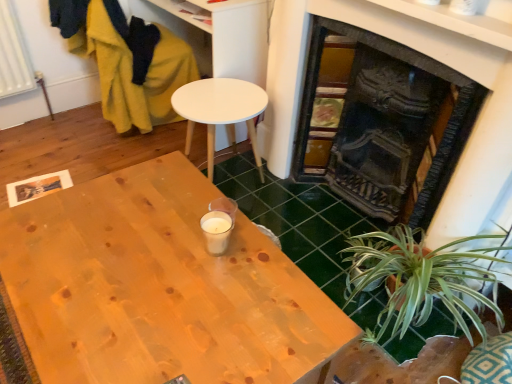
Question: Is green leafy plant at lower right to the left or to the right of white matte table at center in the image?

Choices:
 (A) left
 (B) right

Answer: (B)

Question: Considering their positions, is green leafy plant at lower right located in front of or behind white matte table at center?

Choices:
 (A) front
 (B) behind

Answer: (A)

Question: Based on their relative distances, which object is farther from the natural wood desk at center?

Choices:
 (A) velvet mustard yellow swivel chair at left
 (B) green leafy plant at lower right
 (C) white matte table at center
 (D) black cast iron fireplace at right

Answer: (A)

Question: Estimate the real-world distances between objects in this image. Which object is farther from the velvet mustard yellow swivel chair at left?

Choices:
 (A) green leafy plant at lower right
 (B) black cast iron fireplace at right
 (C) white matte table at center
 (D) natural wood desk at center

Answer: (A)